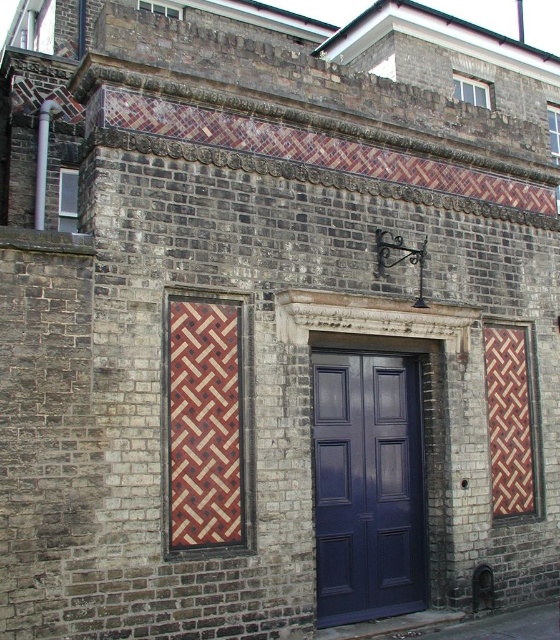
You are standing in front of the building and see two points marked on the wall. The first point is at coordinates point (204, 385) and the second point is at point (516, 385). Which point is closer to you?

Point (204, 385) is in front of point (516, 385), so the first point is closer to you.

You are standing in front of a building with a dull blue wood door at center and a woven wood panel at right. Which object is positioned to the left of the other?

The dull blue wood door at center is to the left of the woven wood panel at right.